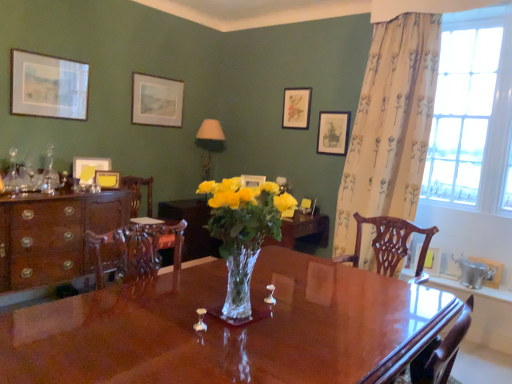
Question: Could you tell me if glossy wood desk at center is facing mahogany wood cabinet at left?

Choices:
 (A) no
 (B) yes

Answer: (B)

Question: Is glossy wood desk at center touching mahogany wood cabinet at left?

Choices:
 (A) yes
 (B) no

Answer: (B)

Question: Can you confirm if glossy wood desk at center is wider than mahogany wood cabinet at left?

Choices:
 (A) no
 (B) yes

Answer: (B)

Question: Can you confirm if glossy wood desk at center is bigger than mahogany wood cabinet at left?

Choices:
 (A) no
 (B) yes

Answer: (B)

Question: Is glossy wood desk at center positioned with its back to mahogany wood cabinet at left?

Choices:
 (A) yes
 (B) no

Answer: (B)

Question: From a real-world perspective, is glossy wood desk at center positioned over mahogany wood cabinet at left based on gravity?

Choices:
 (A) yes
 (B) no

Answer: (B)

Question: Does clear glass vase at center have a greater height compared to floral fabric curtain at right?

Choices:
 (A) no
 (B) yes

Answer: (A)

Question: Is clear glass vase at center next to floral fabric curtain at right?

Choices:
 (A) no
 (B) yes

Answer: (A)

Question: Does clear glass vase at center appear on the right side of floral fabric curtain at right?

Choices:
 (A) yes
 (B) no

Answer: (B)

Question: Is floral fabric curtain at right located within clear glass vase at center?

Choices:
 (A) yes
 (B) no

Answer: (B)

Question: From a real-world perspective, is clear glass vase at center under floral fabric curtain at right?

Choices:
 (A) no
 (B) yes

Answer: (B)

Question: Is clear glass vase at center smaller than floral fabric curtain at right?

Choices:
 (A) no
 (B) yes

Answer: (B)

Question: Can you confirm if yellow paper at left, the third picture frame when ordered from left to right, is bigger than wooden picture frame at right, marked as the 8th picture frame in a left-to-right arrangement?

Choices:
 (A) yes
 (B) no

Answer: (B)